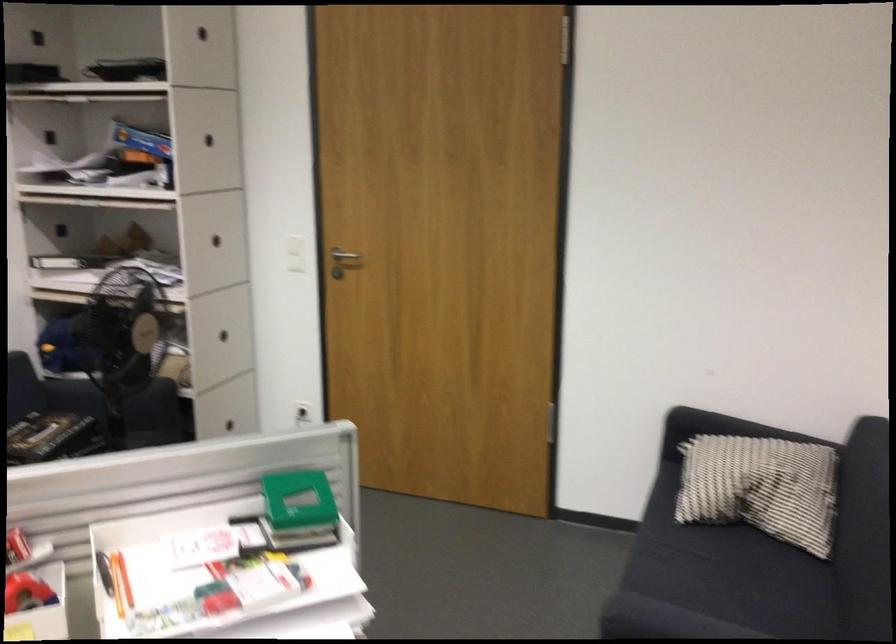
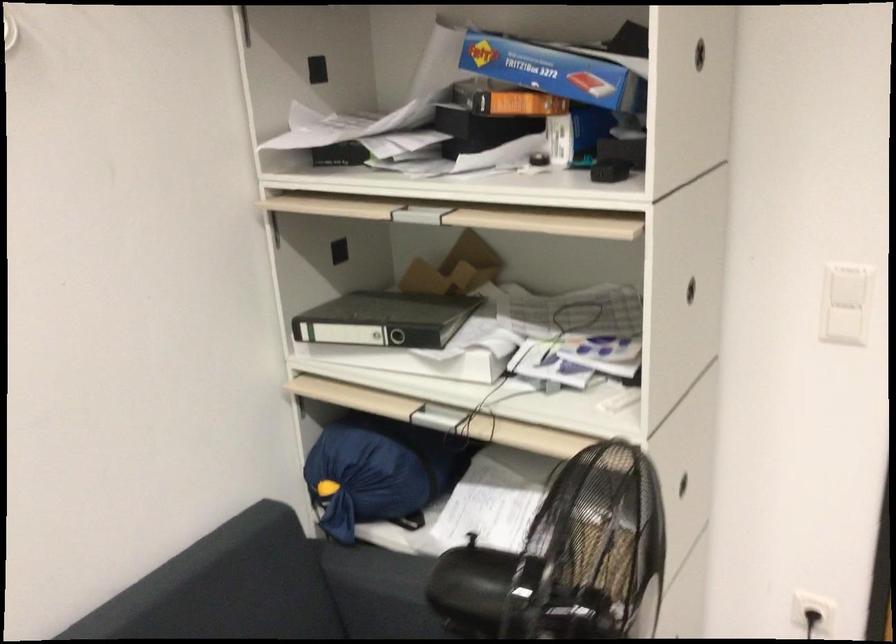
Find the pixel in the second image that matches (x=170, y=182) in the first image.

(608, 171)